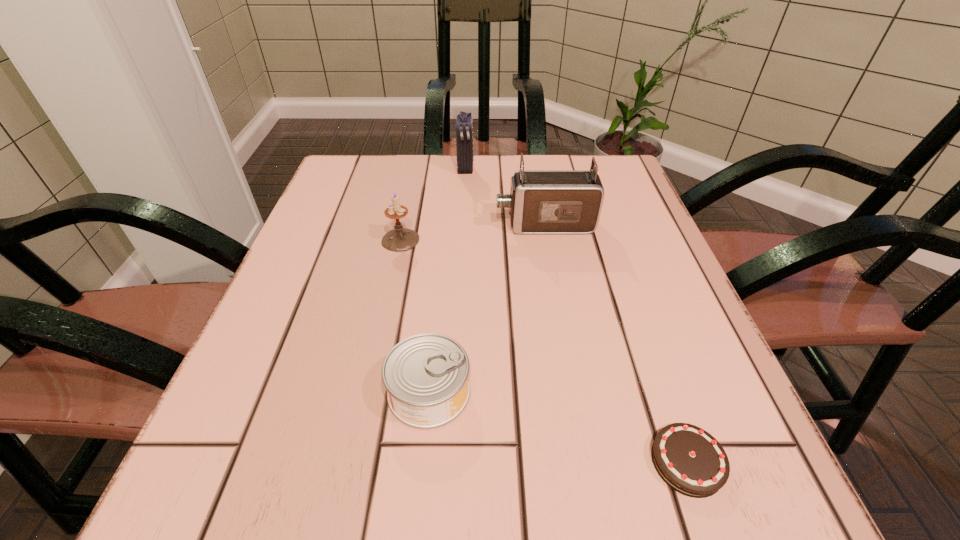
I want to click on vacant space located 0.230m on the left of the can, so click(x=229, y=392).

Where is `vacant area situated 0.070m on the left of the chocolate cake`? The height and width of the screenshot is (540, 960). vacant area situated 0.070m on the left of the chocolate cake is located at coordinates (582, 462).

Locate an element on the screen. The height and width of the screenshot is (540, 960). object positioned at the far edge is located at coordinates [464, 130].

At what (x,y) coordinates should I click in order to perform the action: click on object positioned at the near edge. Please return your answer as a coordinate pair (x, y). The height and width of the screenshot is (540, 960). Looking at the image, I should click on pos(691,461).

Identify the location of object located in the left edge section of the desktop. (399, 239).

Identify the location of camcorder that is at the right edge. The image size is (960, 540). (541, 201).

The image size is (960, 540). I want to click on chocolate cake that is at the right edge, so click(691, 461).

Where is `object located at the near right corner`? The image size is (960, 540). object located at the near right corner is located at coordinates (691, 461).

You are a GUI agent. You are given a task and a screenshot of the screen. Output one action in this format:
    pyautogui.click(x=<x>, y=<y>)
    Task: Click on the free space at the far edge
    
    Given the screenshot: What is the action you would take?
    pyautogui.click(x=503, y=156)

This screenshot has height=540, width=960. In order to click on free space at the left edge of the desktop in this screenshot , I will do `click(334, 330)`.